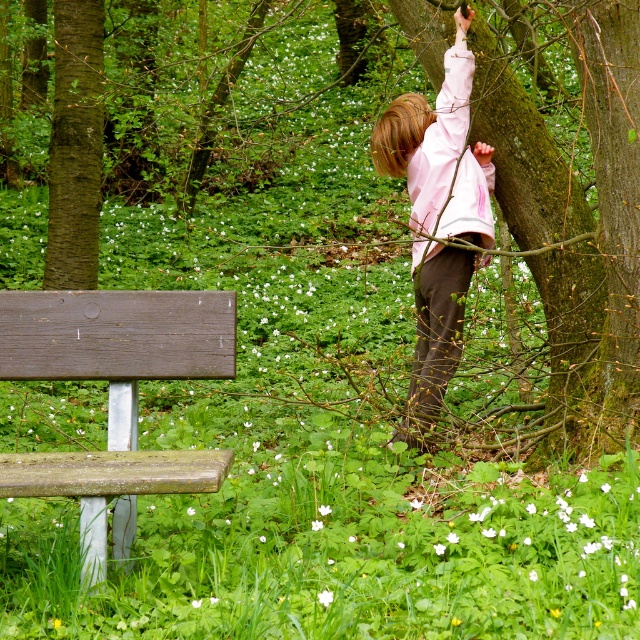
Consider the image. You are a photographer wanting to capture both the smooth bark tree at upper right and the wooden bench at lower left in the same frame. Based on their positions, which object should you focus on first to ensure both are in the shot?

The smooth bark tree at upper right is located above the wooden bench at lower left, so you should focus on the wooden bench at lower left first to ensure both are in the shot.